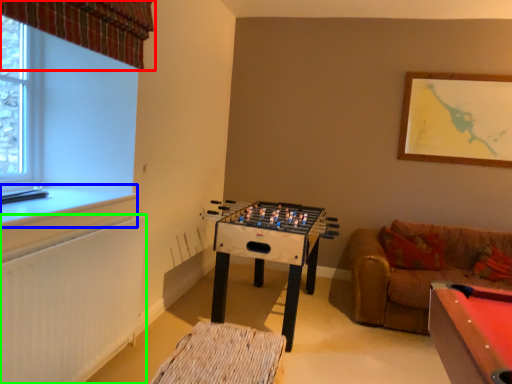
Question: Which is farther away from curtain (highlighted by a red box)? window sill (highlighted by a blue box) or radiator (highlighted by a green box)?

Choices:
 (A) window sill
 (B) radiator

Answer: (B)